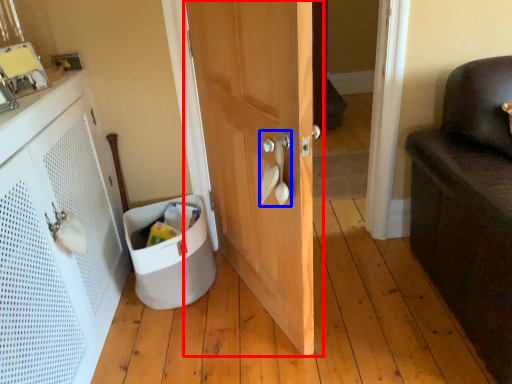
Question: Which object appears closest to the camera in this image, door (highlighted by a red box) or door handle (highlighted by a blue box)?

Choices:
 (A) door
 (B) door handle

Answer: (A)